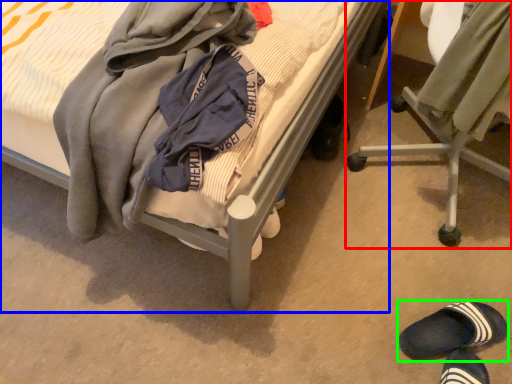
Question: Considering the real-world distances, which object is closest to chair (highlighted by a red box)? bed (highlighted by a blue box) or footwear (highlighted by a green box).

Choices:
 (A) bed
 (B) footwear

Answer: (A)